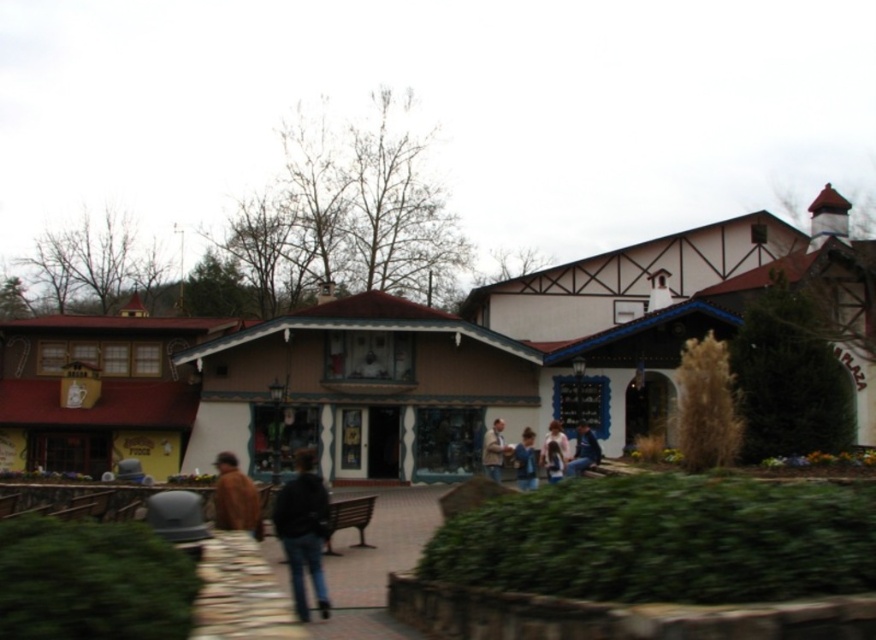
You are standing at the entrance of the building and want to sit down. Which object at point (384, 545) is available for sitting?

The dark brown wooden bench at center is located at point (384, 545) and is available for sitting.

You are a visitor standing at the entrance of the matte brown building at center. You want to sit on the dark brown wooden bench at center. Is the building wider than the bench?

The matte brown building at center is wider than the dark brown wooden bench at center, so yes, the building is wider than the bench.